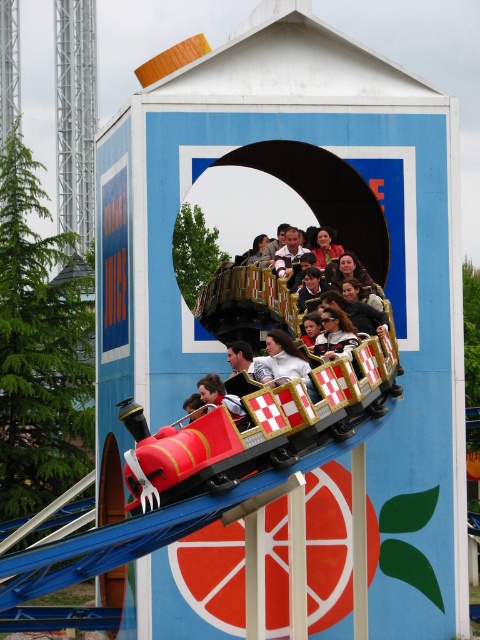
You are standing in the amusement park and see the metallic red roller coaster at center and the matte black roller coaster car at center. Which one is positioned more to the right side?

The metallic red roller coaster at center is positioned more to the right side than the matte black roller coaster car at center.

You are standing at the entrance of the amusement park and want to locate the metallic red roller coaster at center. According to the coordinate system where the bottom left corner is the origin, where would you find it?

The metallic red roller coaster at center is located at the coordinate point of 0.709 on the x axis and 0.448 on the y axis.

You are a photographer trying to capture a clear photo of the metallic red roller coaster at center and the matte black sunglasses at center. However, you notice that one object might block the view of the other. Based on their sizes, which object is more likely to block the other?

The metallic red roller coaster at center might be wider than matte black sunglasses at center, so it is more likely to block the view of the matte black sunglasses at center.